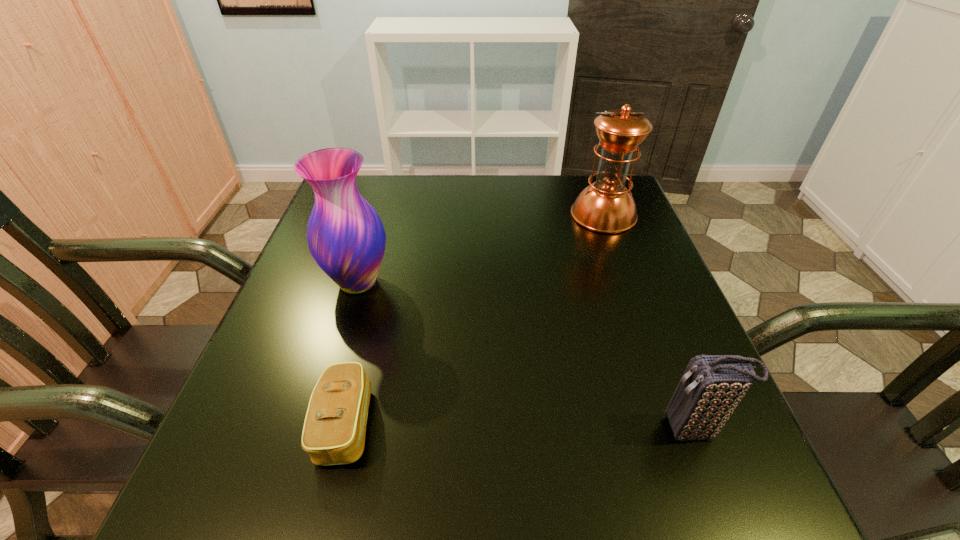
Locate an element on the screen. free space between the shortest object and the right clutch bag is located at coordinates (519, 426).

At what (x,y) coordinates should I click in order to perform the action: click on vacant area that lies between the farthest object and the left clutch bag. Please return your answer as a coordinate pair (x, y). Looking at the image, I should click on (474, 319).

At what (x,y) coordinates should I click in order to perform the action: click on free point between the taller clutch bag and the left clutch bag. Please return your answer as a coordinate pair (x, y). Looking at the image, I should click on (519, 426).

Where is `free spot between the shorter clutch bag and the third nearest object`? free spot between the shorter clutch bag and the third nearest object is located at coordinates (351, 353).

This screenshot has width=960, height=540. What are the coordinates of `free spot between the right clutch bag and the shortest object` in the screenshot? It's located at (519, 426).

Identify the location of free space between the taller clutch bag and the left clutch bag. The height and width of the screenshot is (540, 960). (519, 426).

Where is `the closest object to the vase`? the closest object to the vase is located at coordinates (334, 430).

Locate an element on the screen. object that stands as the closest to the left clutch bag is located at coordinates (346, 237).

Locate an element on the screen. vacant position in the image that satisfies the following two spatial constraints: 1. on the back side of the third nearest object; 2. on the left side of the oil lamp is located at coordinates (378, 214).